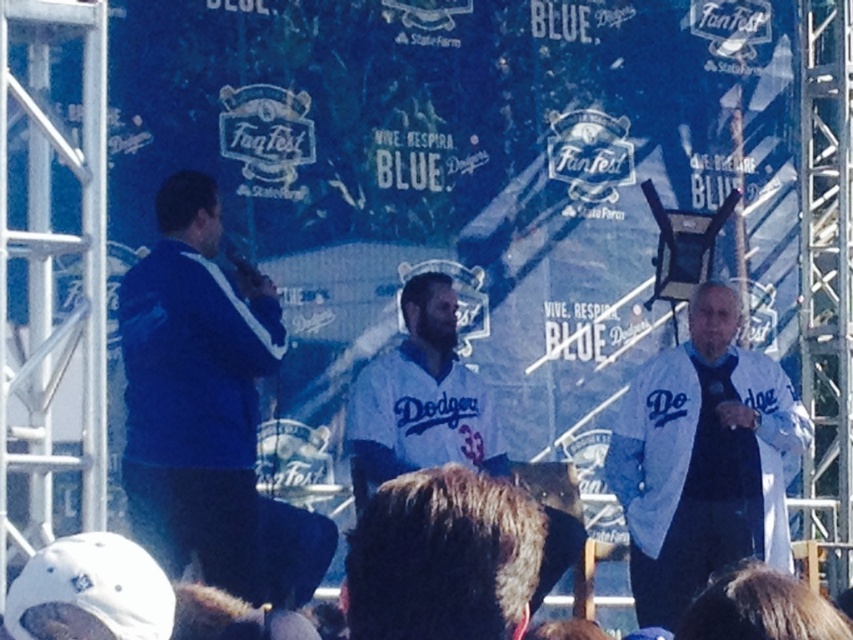
Is white fabric jacket at right wider than white jersey at center?

No.

Identify the location of white fabric jacket at right. The width and height of the screenshot is (853, 640). tap(703, 460).

Based on the photo, does brown fur at center appear on the right side of white jersey at center?

In fact, brown fur at center is to the left of white jersey at center.

Who is positioned more to the left, brown fur at center or white jersey at center?

From the viewer's perspective, brown fur at center appears more on the left side.

Who is more distant from viewer, (459, 620) or (418, 276)?

Positioned behind is point (418, 276).

Find the location of `brown fur at center`. brown fur at center is located at coordinates (442, 557).

Is point (194, 384) in front of point (776, 397)?

That is True.

Does blue fabric jacket at left have a greater height compared to white fabric jacket at right?

No, blue fabric jacket at left is not taller than white fabric jacket at right.

This screenshot has height=640, width=853. What do you see at coordinates (206, 412) in the screenshot?
I see `blue fabric jacket at left` at bounding box center [206, 412].

The width and height of the screenshot is (853, 640). In order to click on blue fabric jacket at left in this screenshot , I will do tap(206, 412).